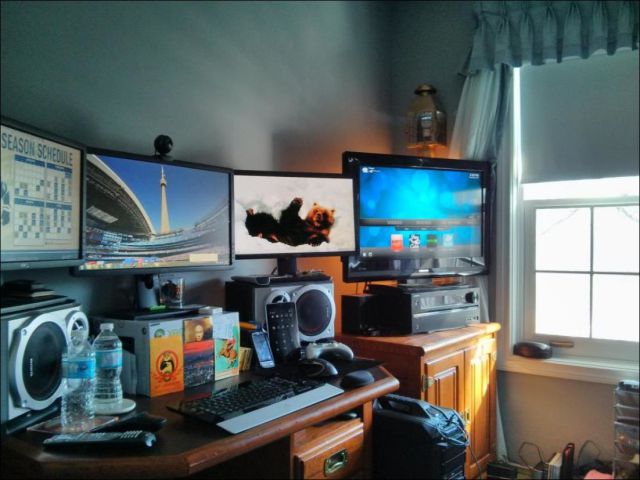
The width and height of the screenshot is (640, 480). In order to click on keyboard in this screenshot , I will do `click(244, 405)`.